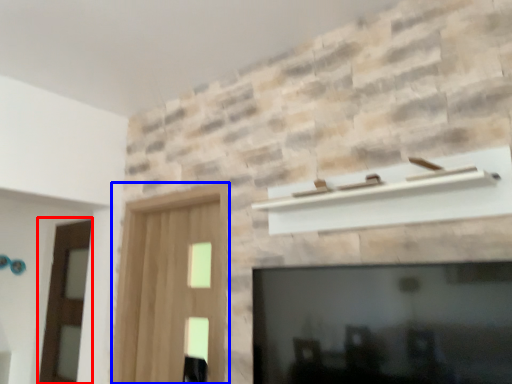
Question: Which object appears closest to the camera in this image, screen door (highlighted by a red box) or screen door (highlighted by a blue box)?

Choices:
 (A) screen door
 (B) screen door

Answer: (B)